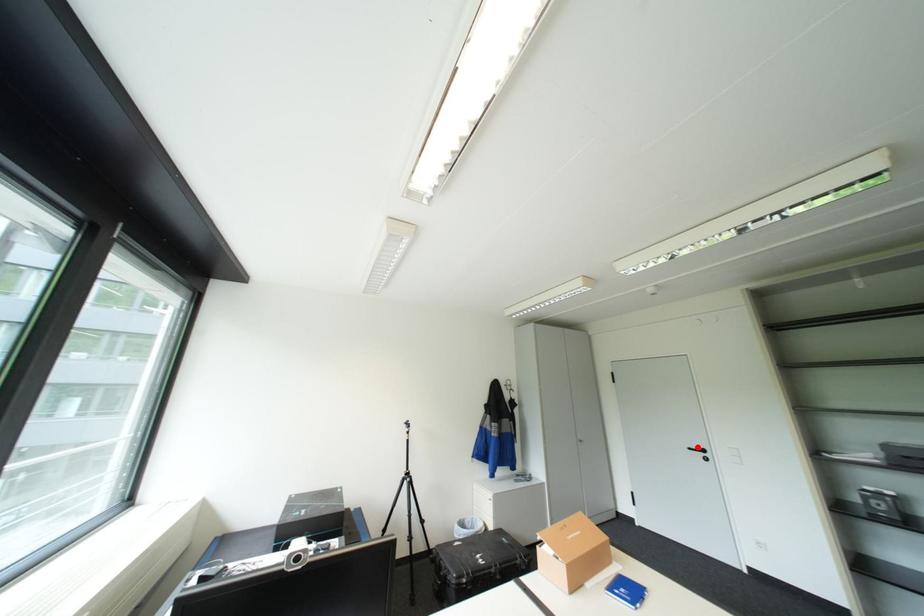
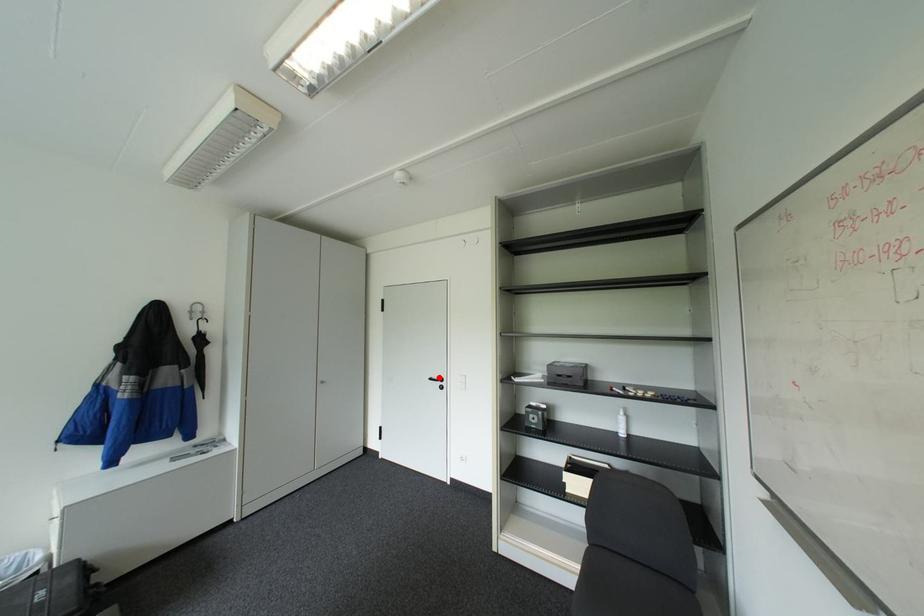
I am providing you with two images of the same scene from different viewpoints. A red point is marked on the first image and another point is marked on the second image. Is the marked point in image1 the same physical position as the marked point in image2?

Yes